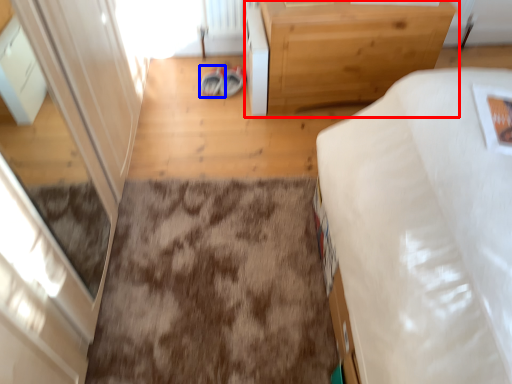
Question: Among these objects, which one is nearest to the camera, table (highlighted by a red box) or footwear (highlighted by a blue box)?

Choices:
 (A) table
 (B) footwear

Answer: (A)